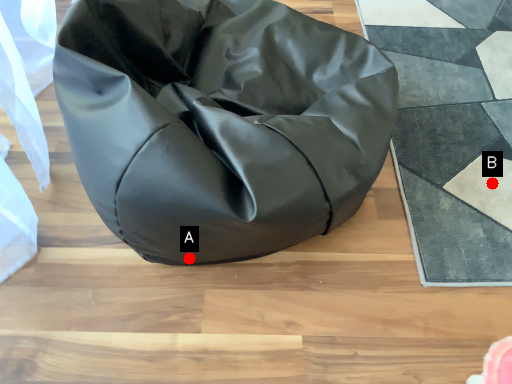
Question: Two points are circled on the image, labeled by A and B beside each circle. Which of the following is the farthest from the observer?

Choices:
 (A) A is further
 (B) B is further

Answer: (B)